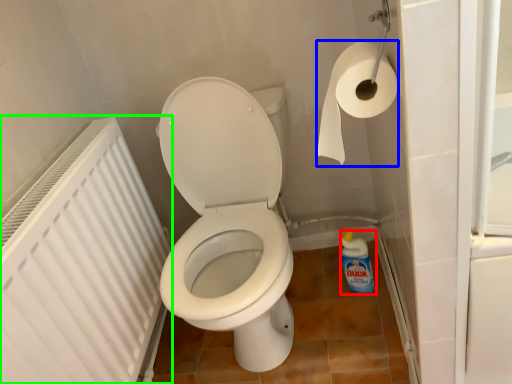
Question: Which object is the closest to the cleaning product (highlighted by a red box)? Choose among these: toilet paper (highlighted by a blue box) or radiator (highlighted by a green box).

Choices:
 (A) toilet paper
 (B) radiator

Answer: (A)